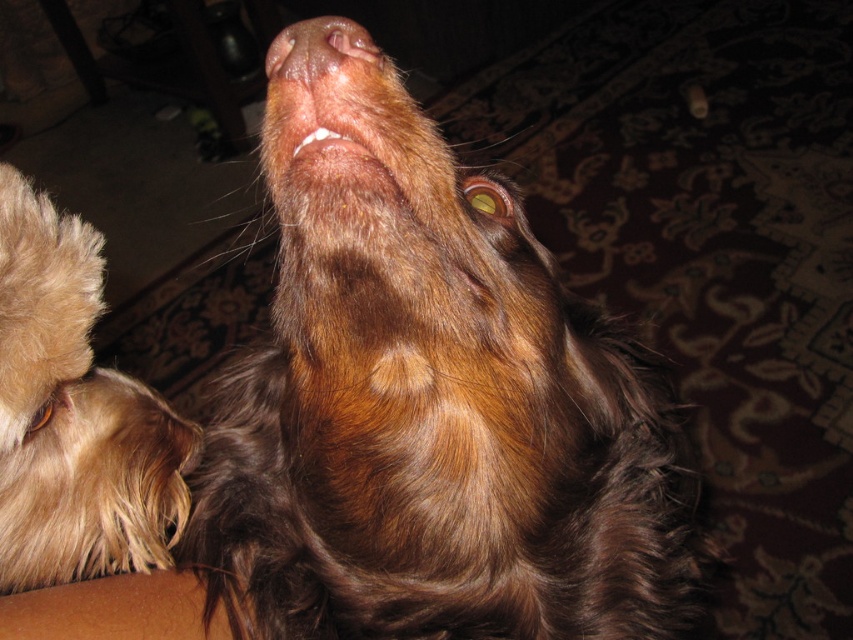
Is fuzzy brown fur at lower left closer to the viewer compared to pink smooth nose at upper center?

Yes, fuzzy brown fur at lower left is in front of pink smooth nose at upper center.

Measure the distance between fuzzy brown fur at lower left and pink smooth nose at upper center.

10.51 inches

Is point (90, 397) behind point (331, 22)?

Yes, it is.

The height and width of the screenshot is (640, 853). I want to click on fuzzy brown fur at lower left, so click(x=74, y=413).